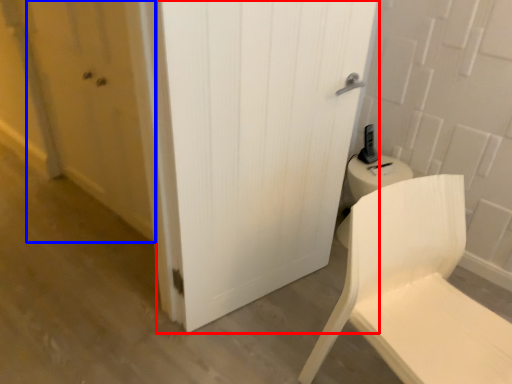
Question: Which of the following is the closest to the observer, door (highlighted by a red box) or screen door (highlighted by a blue box)?

Choices:
 (A) door
 (B) screen door

Answer: (A)